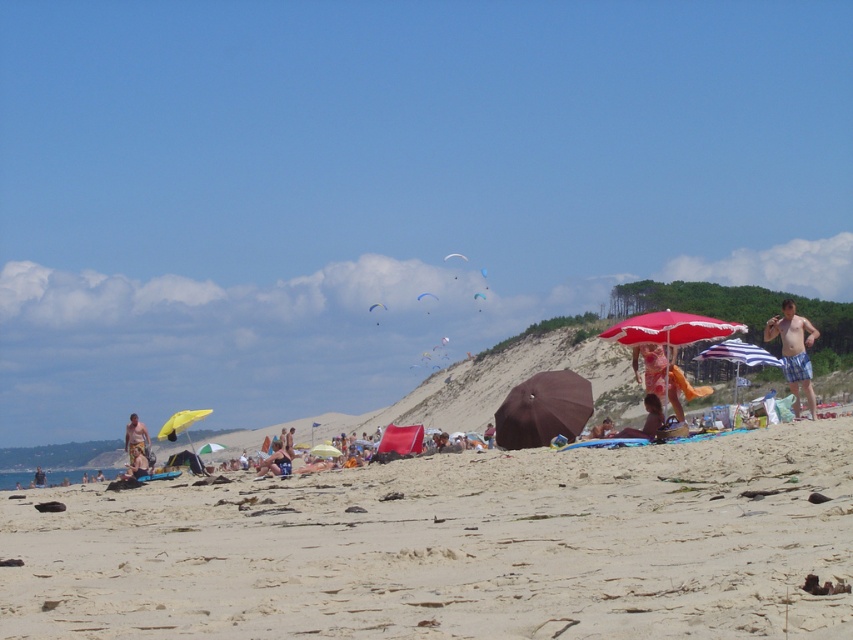
Question: Which point is closer to the camera?

Choices:
 (A) (659, 406)
 (B) (256, 474)

Answer: (A)

Question: Does blue plaid shorts at right have a greater width compared to smooth tan skin at center?

Choices:
 (A) no
 (B) yes

Answer: (B)

Question: Which of the following is the farthest from the observer?

Choices:
 (A) yellow matte umbrella at center
 (B) brown matte umbrella at center
 (C) blue plaid shorts at right
 (D) smooth tan skin at center

Answer: (A)

Question: Estimate the real-world distances between objects in this image. Which object is farther from the brown matte umbrella at center?

Choices:
 (A) red fabric umbrella at center
 (B) yellow striped shorts at lower left

Answer: (B)

Question: Is red fabric umbrella at center in front of smooth tan skin at center?

Choices:
 (A) yes
 (B) no

Answer: (B)

Question: Does brown matte umbrella at center have a greater width compared to smooth tan skin at center?

Choices:
 (A) yes
 (B) no

Answer: (A)